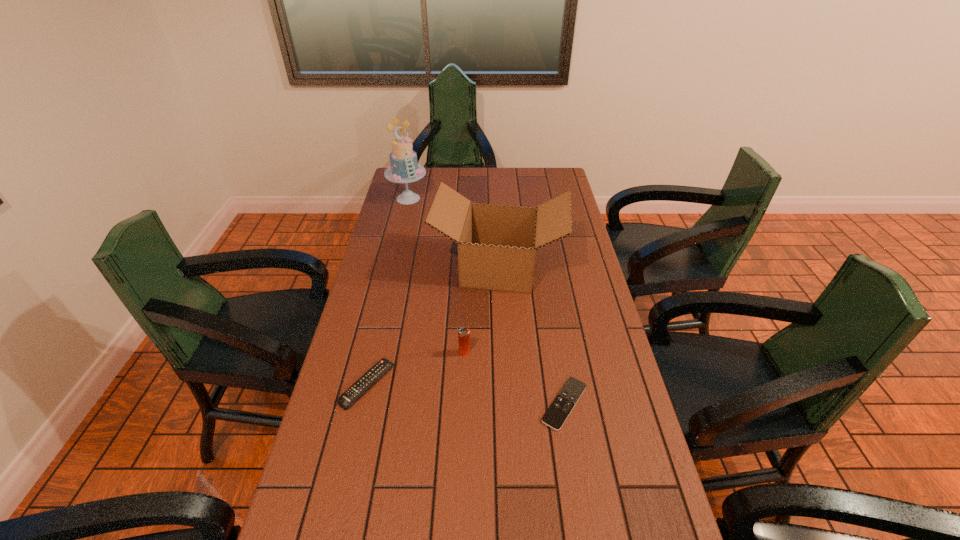
Identify the location of object that is at the far left corner. The image size is (960, 540). tap(403, 168).

At what (x,y) coordinates should I click in order to perform the action: click on vacant space at the far edge of the desktop. Please return your answer as a coordinate pair (x, y). This screenshot has height=540, width=960. Looking at the image, I should click on (477, 190).

Where is `vacant area at the left edge of the desktop`? This screenshot has height=540, width=960. vacant area at the left edge of the desktop is located at coordinates (394, 293).

What are the coordinates of `blank area at the right edge` in the screenshot? It's located at (583, 271).

The image size is (960, 540). Identify the location of vacant space at the far left corner of the desktop. (419, 187).

Locate an element on the screen. The height and width of the screenshot is (540, 960). vacant point located between the box and the shorter remote control is located at coordinates (532, 335).

At what (x,y) coordinates should I click in order to perform the action: click on free area in between the left remote control and the third tallest object. Please return your answer as a coordinate pair (x, y). Looking at the image, I should click on (417, 368).

Image resolution: width=960 pixels, height=540 pixels. Find the location of `free area in between the fourth shortest object and the shorter remote control`. free area in between the fourth shortest object and the shorter remote control is located at coordinates (532, 335).

Identify the location of empty space that is in between the igniter and the right remote control. The height and width of the screenshot is (540, 960). (515, 378).

You are a GUI agent. You are given a task and a screenshot of the screen. Output one action in this format:
    pyautogui.click(x=<x>, y=<y>)
    Task: Click on the free point between the second tallest object and the third tallest object
    The height and width of the screenshot is (540, 960).
    Given the screenshot: What is the action you would take?
    pyautogui.click(x=482, y=310)